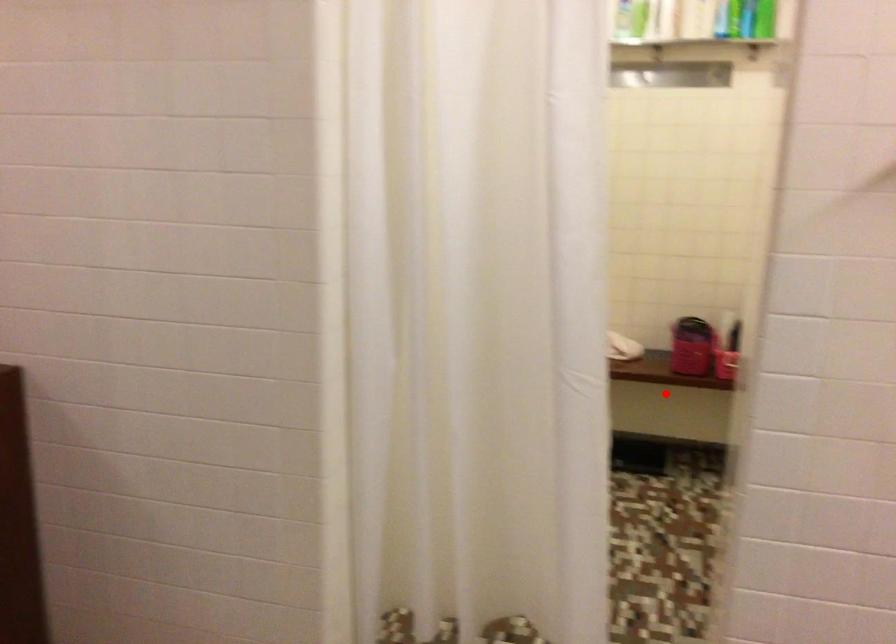
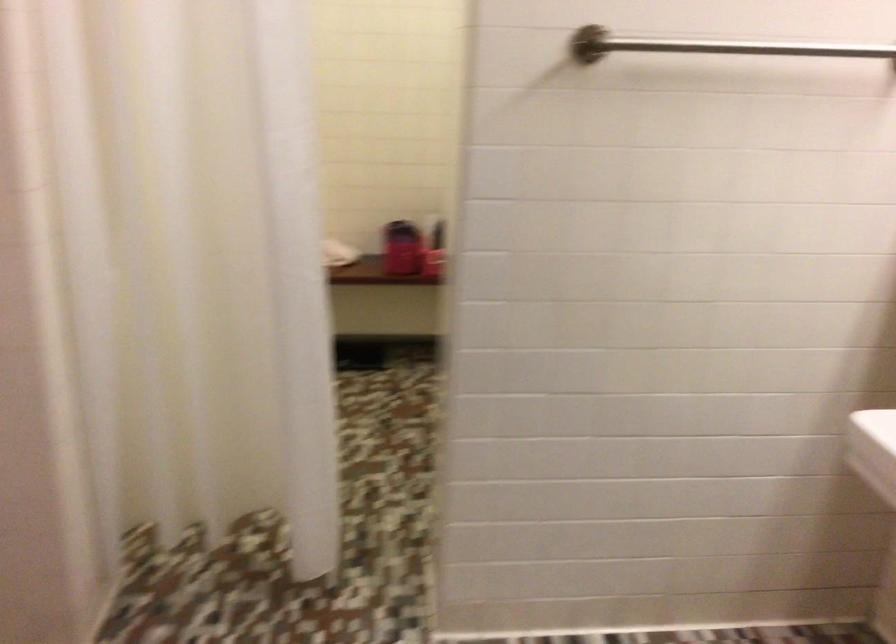
Find the pixel in the second image that matches the highlighted location in the first image.

(382, 301)